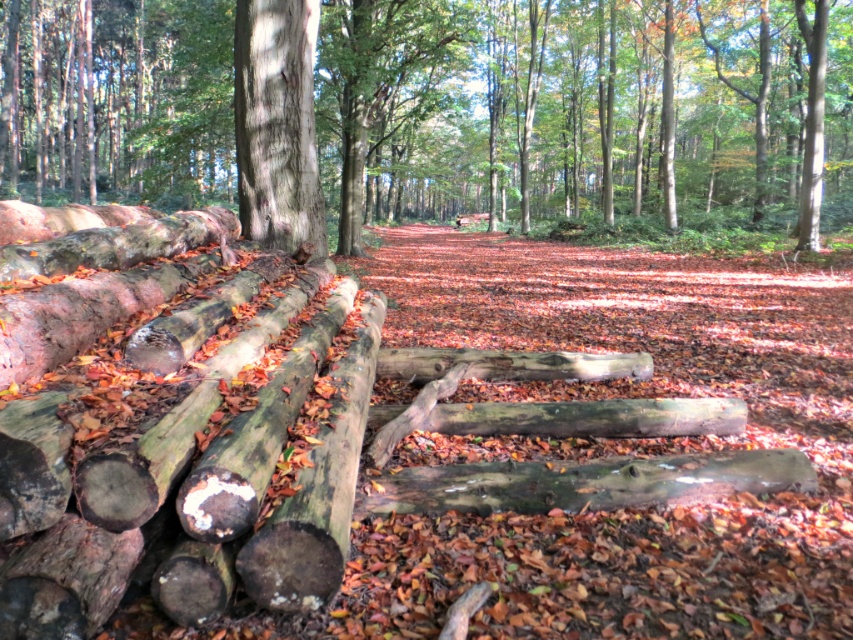
This screenshot has height=640, width=853. What do you see at coordinates (581, 108) in the screenshot?
I see `smooth bark tree at center` at bounding box center [581, 108].

Who is shorter, smooth bark tree at center or smooth gray bark at center?

smooth gray bark at center

Who is more forward, [331,22] or [265,109]?

Point [265,109]

Where is `smooth bark tree at center`? The width and height of the screenshot is (853, 640). smooth bark tree at center is located at coordinates point(581,108).